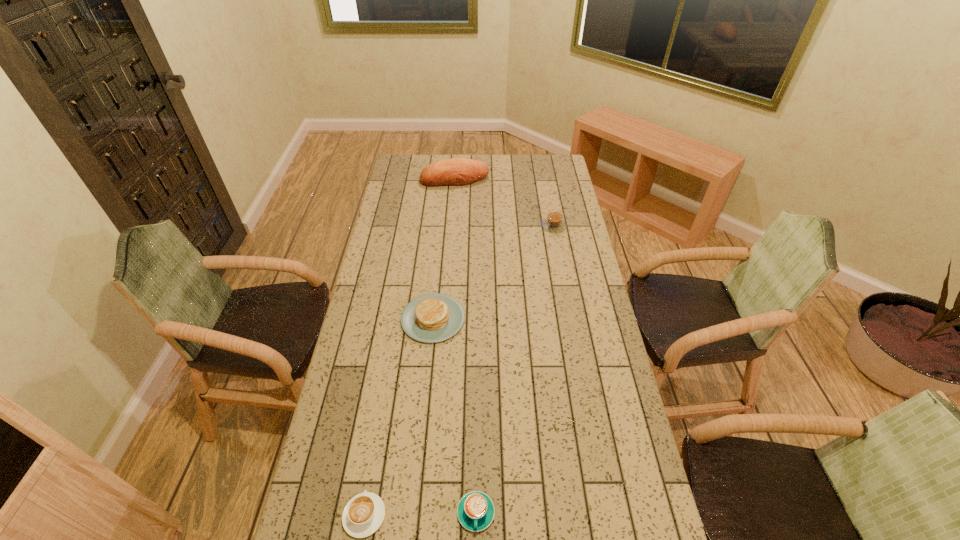
Locate an element on the screen. vacant space at the right edge of the desktop is located at coordinates click(x=599, y=387).

This screenshot has width=960, height=540. What are the coordinates of `vacant space at the far left corner of the desktop` in the screenshot? It's located at (422, 163).

This screenshot has height=540, width=960. What are the coordinates of `empty space between the second cappuccino from left to right and the rightmost object` in the screenshot? It's located at (515, 369).

You are a GUI agent. You are given a task and a screenshot of the screen. Output one action in this format:
    pyautogui.click(x=<x>, y=<y>)
    Task: Click on the free area in between the third nearest object and the leftmost cappuccino
    The image size is (960, 540).
    Given the screenshot: What is the action you would take?
    pyautogui.click(x=398, y=417)

You are a GUI agent. You are given a task and a screenshot of the screen. Output one action in this format:
    pyautogui.click(x=<x>, y=<y>)
    Task: Click on the unoccupied position between the leftmost cappuccino and the second cappuccino from right to left
    
    Given the screenshot: What is the action you would take?
    pyautogui.click(x=420, y=514)

Identify the location of free space between the farthest object and the leftmost cappuccino. (x=410, y=347).

At what (x,y) coordinates should I click in order to perform the action: click on free space between the second cappuccino from right to left and the third farthest object. Please return your answer as a coordinate pair (x, y). This screenshot has width=960, height=540. Looking at the image, I should click on (454, 416).

Where is `vacant space that's between the second cappuccino from left to right and the tallest object`? The width and height of the screenshot is (960, 540). vacant space that's between the second cappuccino from left to right and the tallest object is located at coordinates (466, 346).

Locate an element on the screen. This screenshot has height=540, width=960. vacant space that's between the leftmost cappuccino and the farthest object is located at coordinates (410, 347).

This screenshot has height=540, width=960. Find the location of `free spot between the third nearest object and the farthest object`. free spot between the third nearest object and the farthest object is located at coordinates (444, 248).